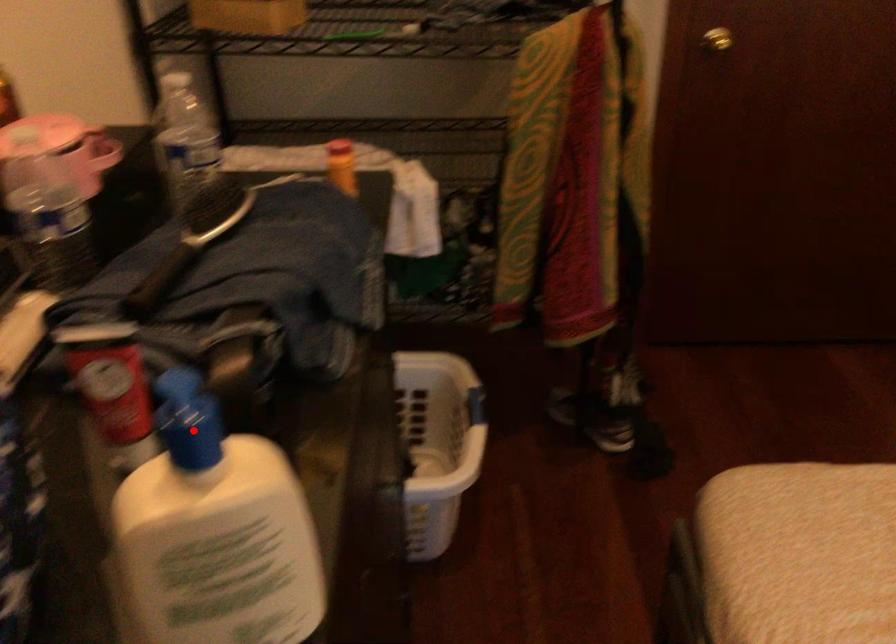
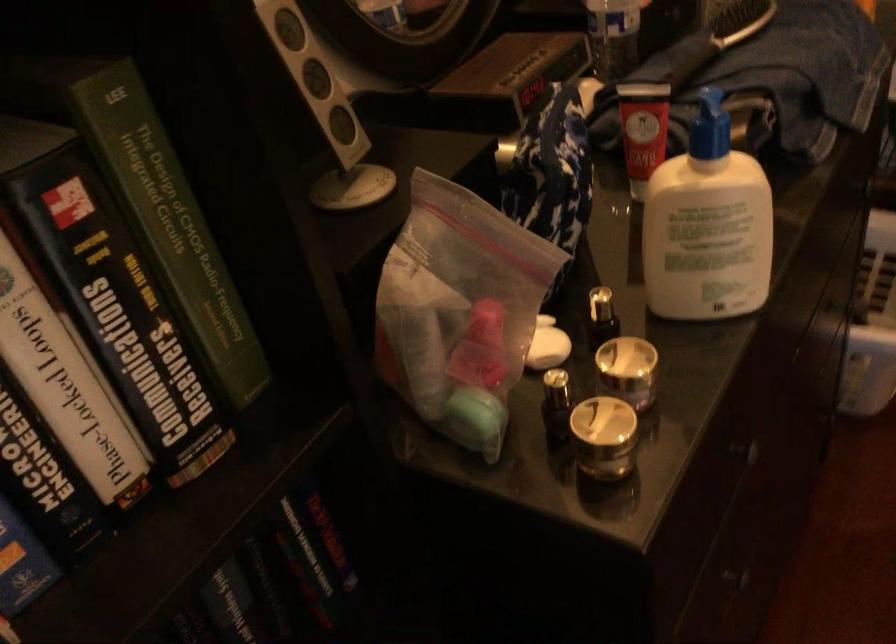
Locate, in the second image, the point that corresponds to the highlighted location in the first image.

(709, 126)